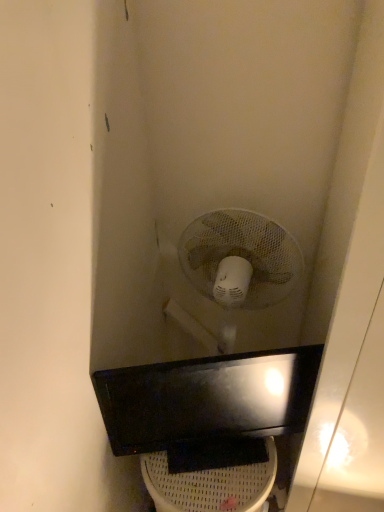
Question: Is black glossy sink at center positioned before white plastic toilet bowl at lower center?

Choices:
 (A) no
 (B) yes

Answer: (B)

Question: Considering the relative positions of black glossy sink at center and white plastic toilet bowl at lower center in the image provided, is black glossy sink at center to the left of white plastic toilet bowl at lower center from the viewer's perspective?

Choices:
 (A) yes
 (B) no

Answer: (B)

Question: Considering the relative sizes of black glossy sink at center and white plastic toilet bowl at lower center in the image provided, is black glossy sink at center shorter than white plastic toilet bowl at lower center?

Choices:
 (A) yes
 (B) no

Answer: (A)

Question: From the image's perspective, is black glossy sink at center over white plastic toilet bowl at lower center?

Choices:
 (A) no
 (B) yes

Answer: (B)

Question: Considering the relative sizes of black glossy sink at center and white plastic toilet bowl at lower center in the image provided, is black glossy sink at center thinner than white plastic toilet bowl at lower center?

Choices:
 (A) no
 (B) yes

Answer: (B)

Question: Is black glossy sink at center bigger than white plastic toilet bowl at lower center?

Choices:
 (A) no
 (B) yes

Answer: (A)

Question: Is white plastic toilet bowl at lower center with black glossy sink at center?

Choices:
 (A) no
 (B) yes

Answer: (A)

Question: Does white plastic toilet bowl at lower center come in front of black glossy sink at center?

Choices:
 (A) no
 (B) yes

Answer: (A)

Question: Can you confirm if white plastic toilet bowl at lower center is bigger than black glossy sink at center?

Choices:
 (A) yes
 (B) no

Answer: (A)

Question: Is white plastic toilet bowl at lower center facing towards black glossy sink at center?

Choices:
 (A) no
 (B) yes

Answer: (A)

Question: Is white plastic toilet bowl at lower center at the left side of black glossy sink at center?

Choices:
 (A) yes
 (B) no

Answer: (A)

Question: Can you confirm if white plastic toilet bowl at lower center is positioned to the right of black glossy sink at center?

Choices:
 (A) yes
 (B) no

Answer: (B)

Question: From a real-world perspective, is black glossy sink at center physically located above or below white plastic toilet bowl at lower center?

Choices:
 (A) below
 (B) above

Answer: (B)